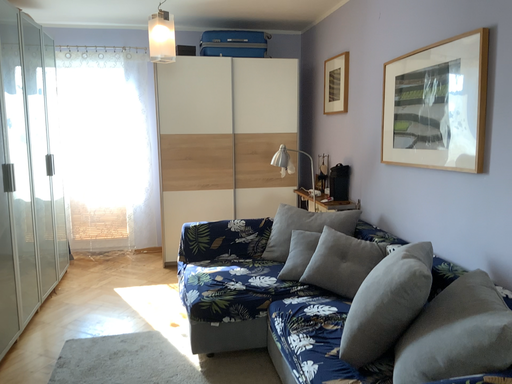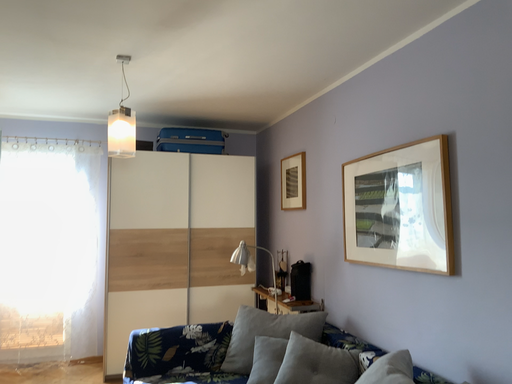
Question: How did the camera likely rotate when shooting the video?

Choices:
 (A) rotated right
 (B) rotated left

Answer: (A)